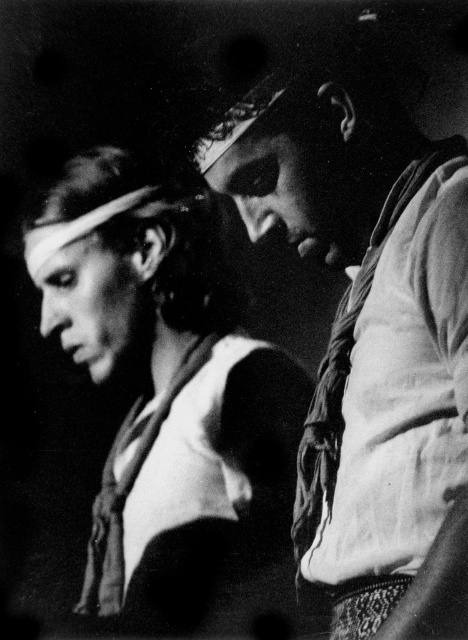
Question: Considering the relative positions of white fabric shirt at right and matte white scarf at center in the image provided, where is white fabric shirt at right located with respect to matte white scarf at center?

Choices:
 (A) below
 (B) above

Answer: (B)

Question: Can you confirm if white fabric shirt at right is wider than matte white scarf at center?

Choices:
 (A) no
 (B) yes

Answer: (A)

Question: Which of the following is the farthest from the observer?

Choices:
 (A) white fabric shirt at right
 (B) matte white scarf at center

Answer: (B)

Question: Among these points, which one is farthest from the camera?

Choices:
 (A) (249, 92)
 (B) (254, 509)

Answer: (B)

Question: Does white fabric shirt at right have a larger size compared to matte white scarf at center?

Choices:
 (A) no
 (B) yes

Answer: (A)